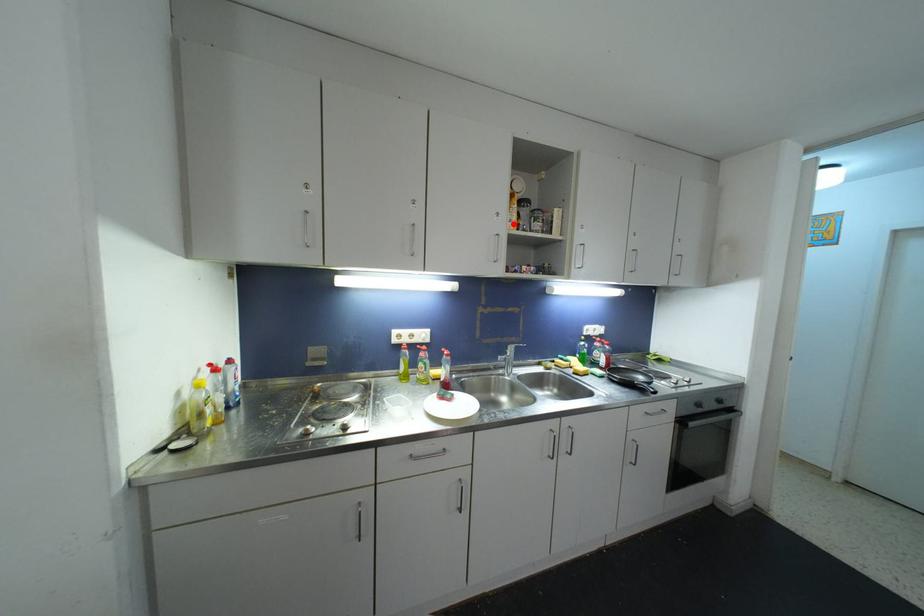
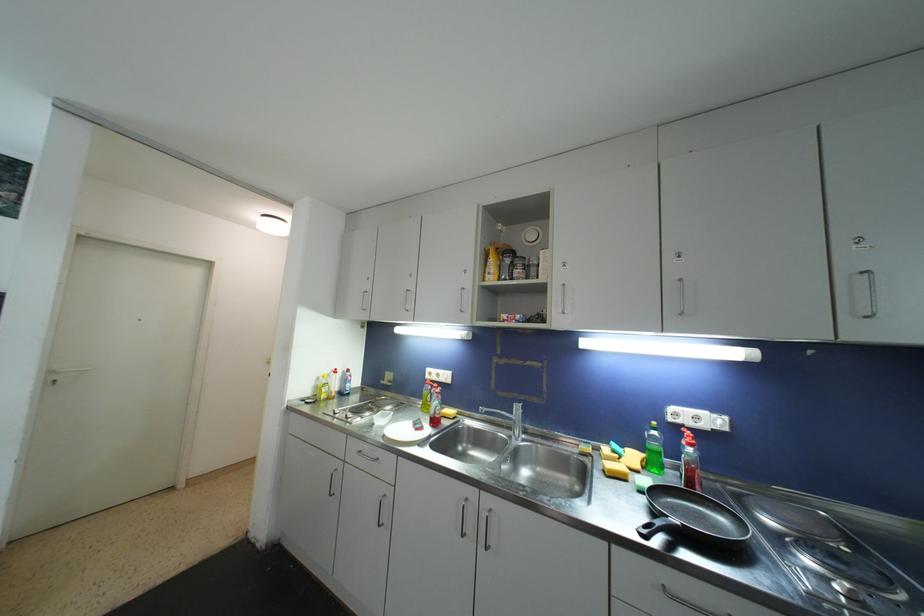
The point at the highlighted location is marked in the first image. Where is the corresponding point in the second image?

(492, 276)